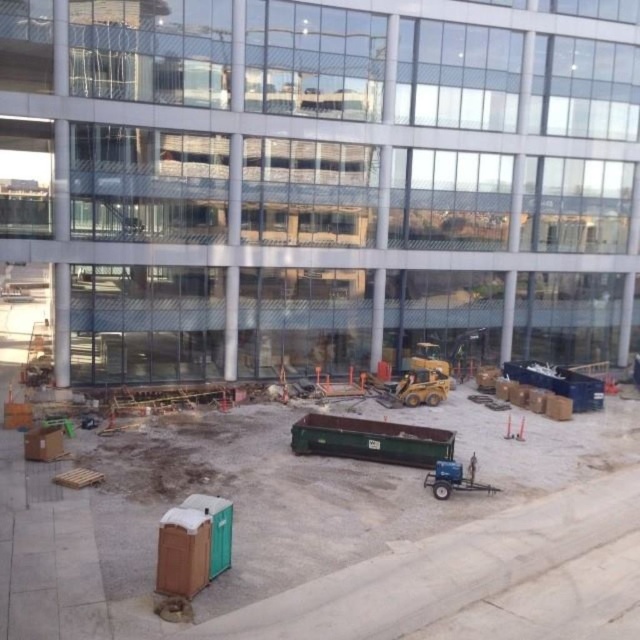
Question: Is transparent glass building at center to the left of green plastic container at lower center from the viewer's perspective?

Choices:
 (A) yes
 (B) no

Answer: (A)

Question: In this image, where is transparent glass building at center located relative to green plastic container at lower center?

Choices:
 (A) left
 (B) right

Answer: (A)

Question: Which is nearer to the blue metallic trailer at lower right?

Choices:
 (A) green plastic container at lower center
 (B) transparent glass building at center

Answer: (A)

Question: Which object is farther from the camera taking this photo?

Choices:
 (A) transparent glass building at center
 (B) green plastic container at lower center

Answer: (A)

Question: Which point is closer to the camera?

Choices:
 (A) green plastic container at lower center
 (B) transparent glass building at center

Answer: (A)

Question: Where is green plastic container at lower center located in relation to blue metallic trailer at lower right in the image?

Choices:
 (A) above
 (B) below

Answer: (B)